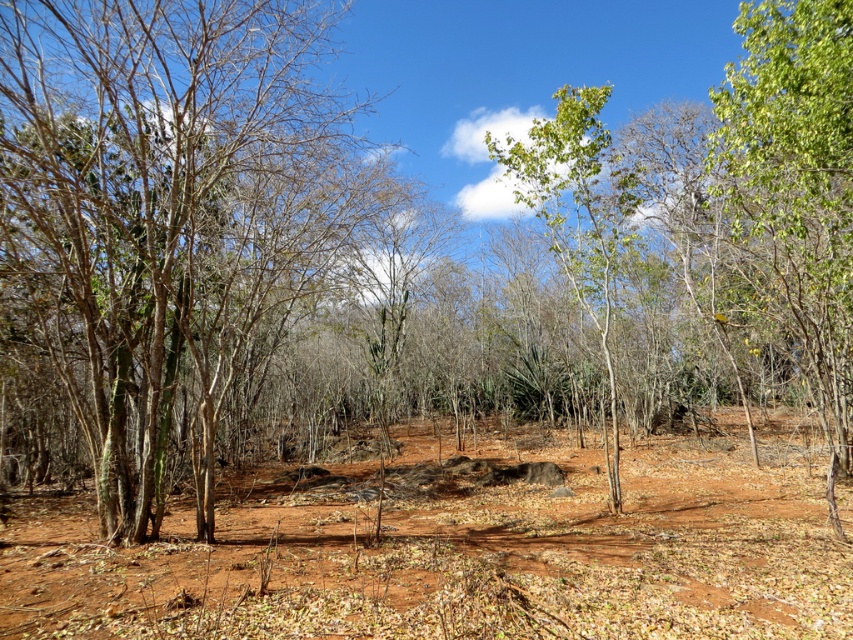
Question: Does dull reddish-brown soil at center appear over green leafy tree at left?

Choices:
 (A) no
 (B) yes

Answer: (A)

Question: Estimate the real-world distances between objects in this image. Which object is closer to the dull reddish-brown soil at center?

Choices:
 (A) green leafy tree at left
 (B) green leafy tree at center

Answer: (B)

Question: Is green leafy tree at left below green leafy tree at center?

Choices:
 (A) no
 (B) yes

Answer: (B)

Question: Among these points, which one is nearest to the camera?

Choices:
 (A) (x=225, y=138)
 (B) (x=605, y=236)

Answer: (A)

Question: Can you confirm if dull reddish-brown soil at center is bigger than green leafy tree at left?

Choices:
 (A) yes
 (B) no

Answer: (A)

Question: Which point is farther from the camera taking this photo?

Choices:
 (A) (231, 276)
 (B) (35, 572)

Answer: (A)